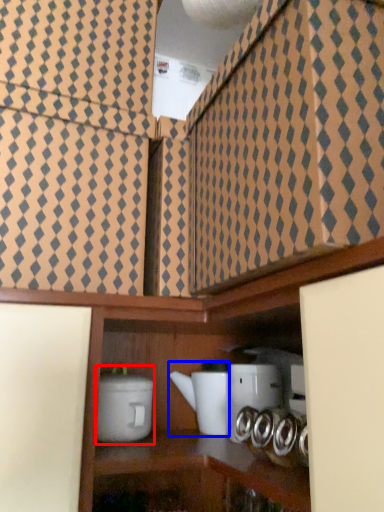
Question: Which object appears farthest to the camera in this image, appliance (highlighted by a red box) or appliance (highlighted by a blue box)?

Choices:
 (A) appliance
 (B) appliance

Answer: (B)